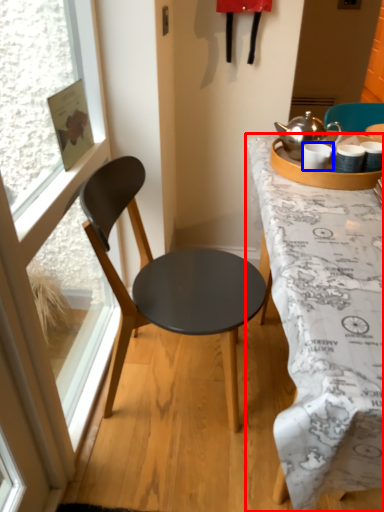
Question: Which point is closer to the camera, desk (highlighted by a red box) or coffee cup (highlighted by a blue box)?

Choices:
 (A) desk
 (B) coffee cup

Answer: (A)